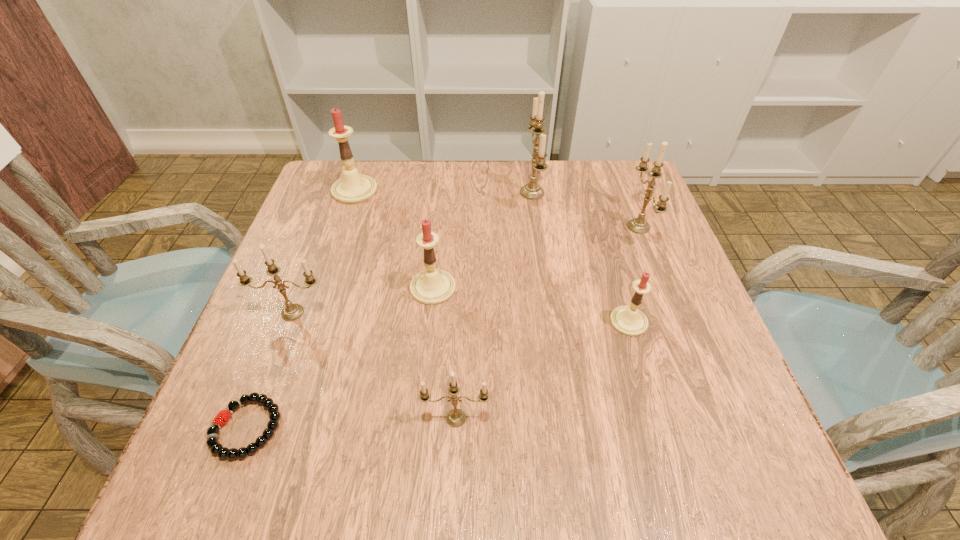
The height and width of the screenshot is (540, 960). Identify the location of free area in between the second smallest red candle and the second candle from right to left. (531, 305).

The height and width of the screenshot is (540, 960). Identify the location of free space between the leftmost metallic candle and the tallest object. (413, 253).

Locate an element on the screen. The height and width of the screenshot is (540, 960). free space between the third smallest metallic candle and the sixth object from left to right is located at coordinates (586, 210).

You are a GUI agent. You are given a task and a screenshot of the screen. Output one action in this format:
    pyautogui.click(x=<x>, y=<y>)
    Task: Click on the free spot between the farthest red candle and the third candle from right to left
    
    Given the screenshot: What is the action you would take?
    pyautogui.click(x=444, y=192)

Find the location of `object that is the fifth closest one to the rightmost candle`. object that is the fifth closest one to the rightmost candle is located at coordinates (353, 188).

Identify which object is the second closest to the second biggest metallic candle. Please provide its 2D coordinates. Your answer should be formatted as a tuple, i.e. [(x, y)], where the tuple contains the x and y coordinates of a point satisfying the conditions above.

[(532, 191)]

Locate which candle is the sixth closest to the tallest candle. Please provide its 2D coordinates. Your answer should be formatted as a tuple, i.e. [(x, y)], where the tuple contains the x and y coordinates of a point satisfying the conditions above.

[(456, 417)]

Where is `candle identified as the closest to the leftmost metallic candle`? candle identified as the closest to the leftmost metallic candle is located at coordinates (433, 286).

You are a GUI agent. You are given a task and a screenshot of the screen. Output one action in this format:
    pyautogui.click(x=<x>, y=<y>)
    Task: Click on the third closest metallic candle relative to the sixth object from left to right
    The height and width of the screenshot is (540, 960).
    Given the screenshot: What is the action you would take?
    pyautogui.click(x=456, y=417)

At what (x,y) coordinates should I click in order to perform the action: click on metallic candle that stands as the second closest to the leftmost metallic candle. Please return your answer as a coordinate pair (x, y). Looking at the image, I should click on (532, 191).